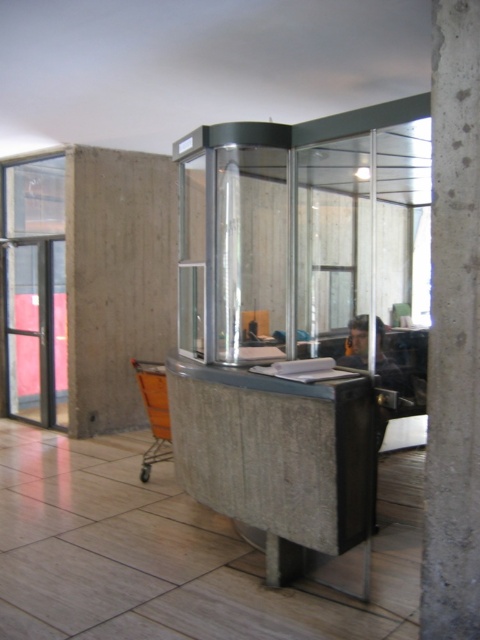
Question: Is concrete pillar at center-right to the right of orange mesh shopping cart at lower left from the viewer's perspective?

Choices:
 (A) yes
 (B) no

Answer: (A)

Question: Which point is closer to the camera?

Choices:
 (A) concrete pillar at center-right
 (B) orange mesh shopping cart at lower left

Answer: (A)

Question: Which point is farther to the camera?

Choices:
 (A) (470, 232)
 (B) (58, 275)
 (C) (168, 404)

Answer: (B)

Question: Can you confirm if concrete pillar at center-right is wider than orange mesh shopping cart at lower left?

Choices:
 (A) yes
 (B) no

Answer: (B)

Question: Is concrete pillar at center-right below transparent glass door at left?

Choices:
 (A) yes
 (B) no

Answer: (B)

Question: Which is nearer to the transparent glass door at left?

Choices:
 (A) concrete pillar at center-right
 (B) orange mesh shopping cart at lower left

Answer: (B)